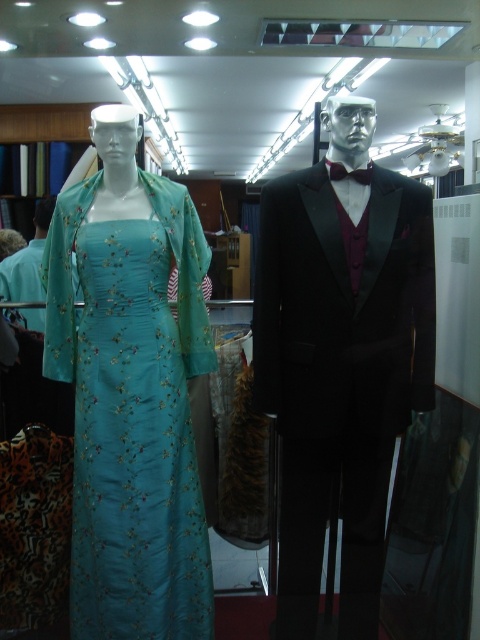
You are a customer in a clothing store and see the teal silk dress at left and the dark purple satin bow tie at center. Which item is located more to the left side of the store?

The teal silk dress at left is positioned on the left side of the dark purple satin bow tie at center, so it is more to the left.

Based on the photo, you are a customer in the store and want to find the teal silk dress at left. According to the store layout, the entrance is at the bottom of the image. Which direction should you look to find it?

The teal silk dress at left is located at point (131, 394), which would be to the upper left from the entrance at the bottom of the image. Look towards the upper left direction from the entrance to find it.

You are a tailor measuring for alterations. You need to adjust the shiny black suit at center and the dark purple satin bow tie at center. Which item requires a wider measurement?

The shiny black suit at center requires a wider measurement because its width surpasses that of the dark purple satin bow tie at center.